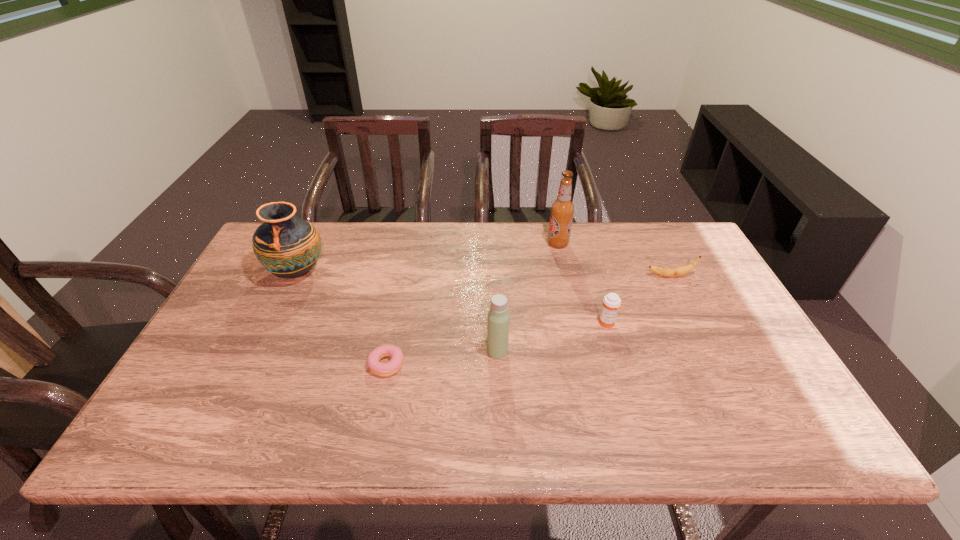
Identify the location of the fifth object from right to left. This screenshot has width=960, height=540. (381, 369).

Where is `free space located 0.360m on the front label of the farthest object`? The height and width of the screenshot is (540, 960). free space located 0.360m on the front label of the farthest object is located at coordinates (437, 244).

Identify the location of free region located on the front label of the farthest object. This screenshot has width=960, height=540. (425, 244).

Locate an element on the screen. free spot located 0.270m on the front label of the farthest object is located at coordinates (465, 244).

The height and width of the screenshot is (540, 960). I want to click on free space located 0.380m on the right of the pottery, so click(451, 272).

Identify the location of vacant space situated 0.100m on the back of the thermos bottle. (496, 315).

I want to click on vacant space located 0.150m on the front of the fifth object from left to right, so click(x=623, y=377).

Identify the location of vacant space situated on the peel of the banana from the top. (520, 276).

Locate an element on the screen. Image resolution: width=960 pixels, height=540 pixels. vacant region located 0.200m on the peel of the banana from the top is located at coordinates (580, 276).

What are the coordinates of `free space located 0.220m on the peel of the banana from the top` in the screenshot? It's located at (573, 276).